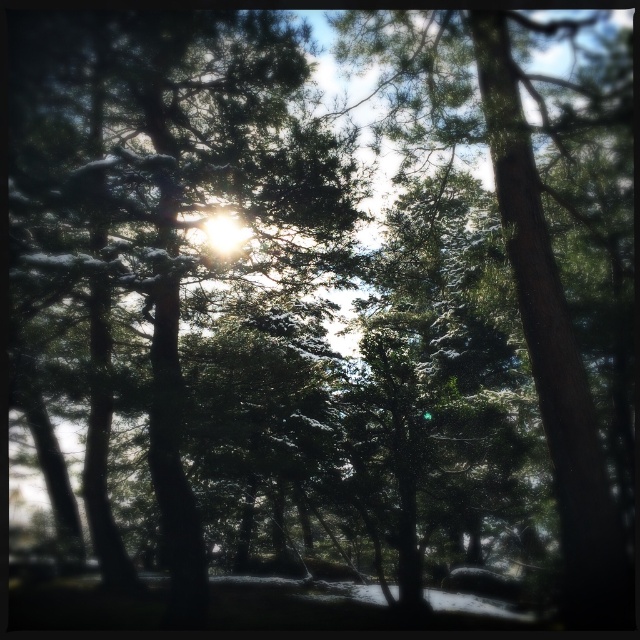
Which of these two, green matte tree at center or green textured tree at center, stands taller?

green matte tree at center is taller.

Which is more to the left, green matte tree at center or green textured tree at center?

Positioned to the left is green matte tree at center.

Which is behind, point (83, 116) or point (500, 161)?

Positioned behind is point (83, 116).

Identify the location of green matte tree at center. This screenshot has height=640, width=640. 163,212.